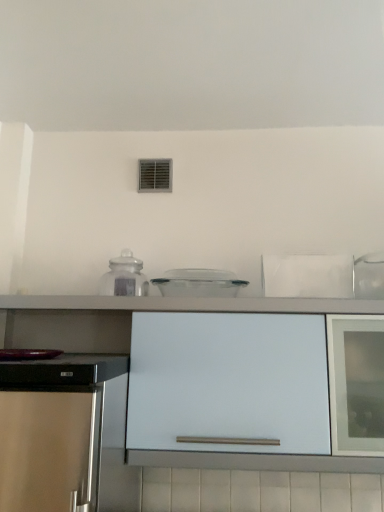
Question: Is white matte cabinet at center taller or shorter than transparent plastic container at center, which is counted as the first kitchen appliance, starting from the right?

Choices:
 (A) short
 (B) tall

Answer: (B)

Question: Considering the positions of white matte cabinet at center and transparent plastic container at center, the 2th kitchen appliance viewed from the left, in the image, is white matte cabinet at center bigger or smaller than transparent plastic container at center, the 2th kitchen appliance viewed from the left,?

Choices:
 (A) big
 (B) small

Answer: (A)

Question: Which object is the farthest from the white matte cabinet at center?

Choices:
 (A) transparent plastic container at center, the 2th kitchen appliance viewed from the left
 (B) transparent glass jar at center, the 2th kitchen appliance when ordered from right to left

Answer: (B)

Question: Considering the real-world distances, which object is closest to the transparent glass jar at center, the first kitchen appliance positioned from the left?

Choices:
 (A) transparent plastic container at center, which is counted as the first kitchen appliance, starting from the right
 (B) white matte cabinet at center

Answer: (A)